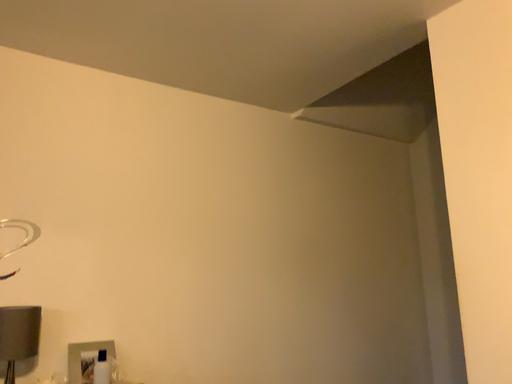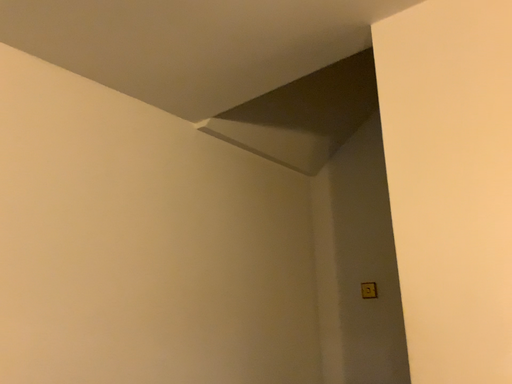
Question: Which way did the camera rotate in the video?

Choices:
 (A) rotated left
 (B) rotated right

Answer: (B)